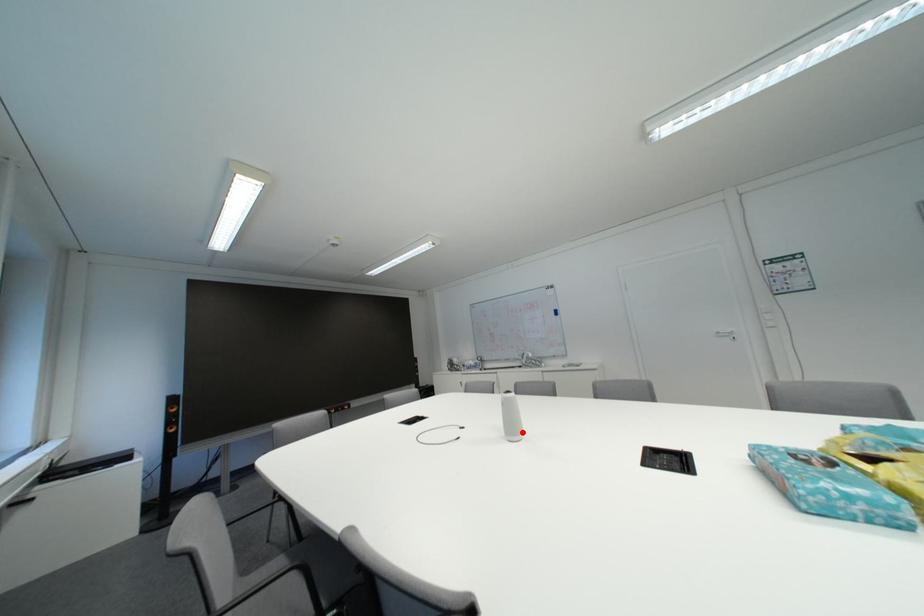
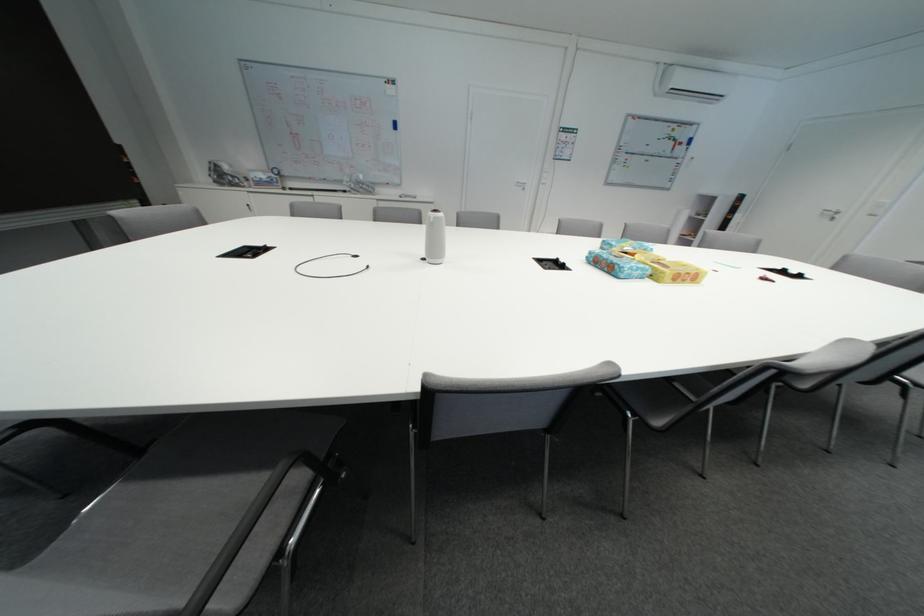
Question: I am providing you with two images of the same scene from different viewpoints. In image1, a red point is highlighted. Considering the same 3D point in image2, which of the following is correct?

Choices:
 (A) It is closer
 (B) It is farther

Answer: (A)